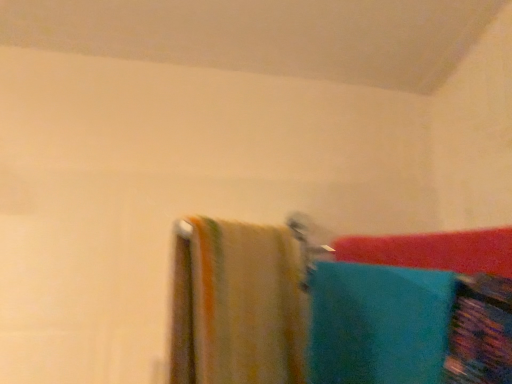
Describe the element at coordinates (480, 331) in the screenshot. I see `teal matte paperback book at lower right` at that location.

You are a GUI agent. You are given a task and a screenshot of the screen. Output one action in this format:
    pyautogui.click(x=<x>, y=<y>)
    Task: Click on the teal matte paperback book at lower right
    The image size is (512, 384).
    Given the screenshot: What is the action you would take?
    pyautogui.click(x=480, y=331)

This screenshot has height=384, width=512. What are the coordinates of `teal matte paperback book at lower right` in the screenshot? It's located at (480, 331).